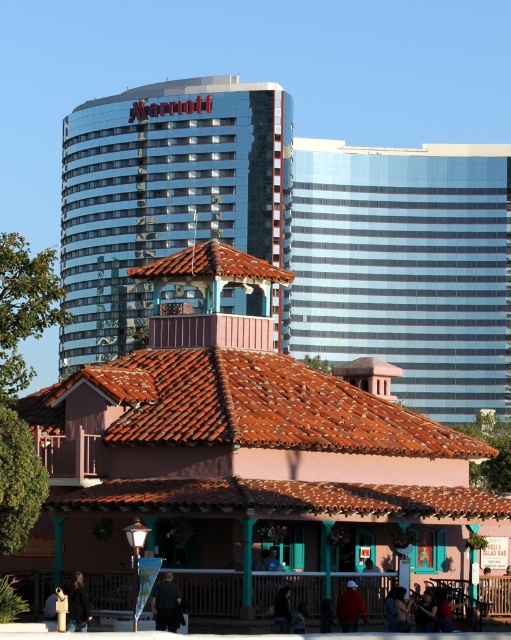
You are a city planner assessing the visual impact of the two glassy blue skyscrapers in the image. Which of the two glassy blue skyscraper at upper right and glassy blue skyscraper at upper center appears smaller in the scene?

The glassy blue skyscraper at upper right appears smaller in the scene compared to the glassy blue skyscraper at upper center.

You are standing at the base of the low rise building with the terracotta roof. You want to take a photo of the point at coordinates point (509, 177). Your camera has a maximum zoom range of 200 meters. Can you capture the point in your photo without moving?

The point point (509, 177) is 198.17 meters away from the camera. Since the camera can zoom up to 200 meters, you can capture the point in your photo without moving.

You are standing at the point marked by the coordinate point (247, 448) in the image. What architectural style do you see around you?

The point at coordinate (247, 448) indicates the matte teal tower at center, which is a modern architectural style with reflective glass surfaces, contrasting with the Spanish or Mediterranean influenced building in the foreground.